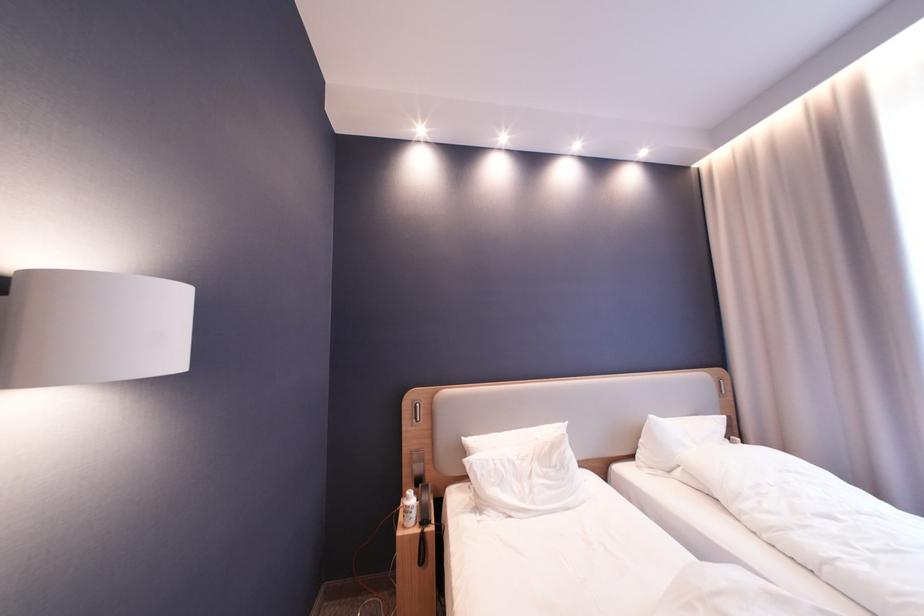
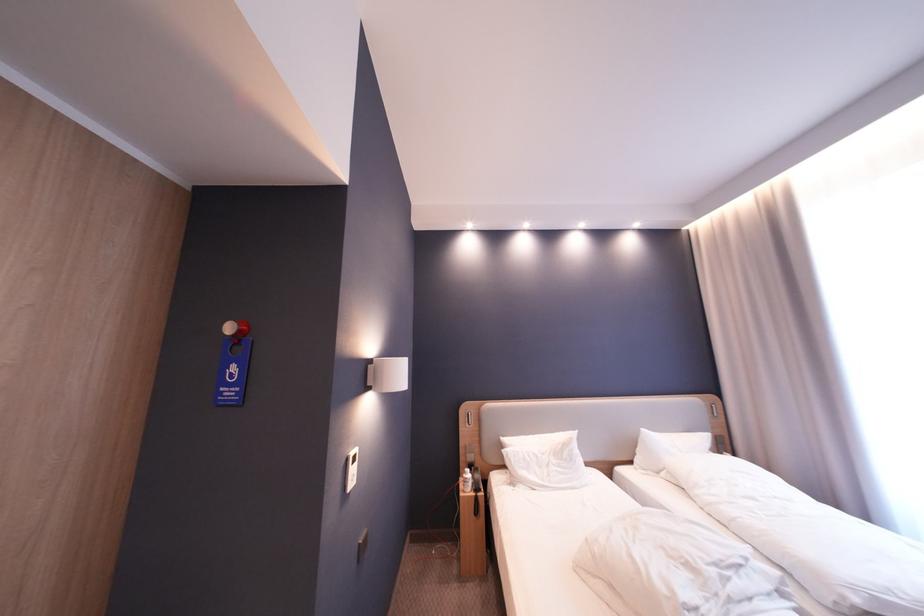
Locate, in the second image, the point that corresponds to [528,464] in the first image.

(550, 456)